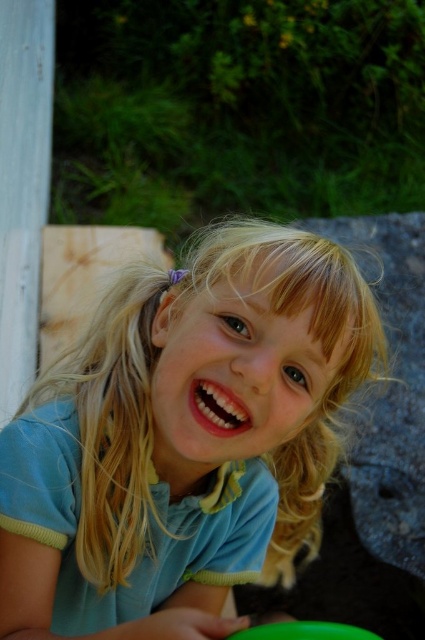
Is blue cotton shirt at center wider than green plastic frisbee at lower center?

Yes.

Does blue cotton shirt at center have a lesser height compared to green plastic frisbee at lower center?

No, blue cotton shirt at center is not shorter than green plastic frisbee at lower center.

You are a GUI agent. You are given a task and a screenshot of the screen. Output one action in this format:
    pyautogui.click(x=<x>, y=<y>)
    Task: Click on the blue cotton shirt at center
    
    Given the screenshot: What is the action you would take?
    pyautogui.click(x=183, y=438)